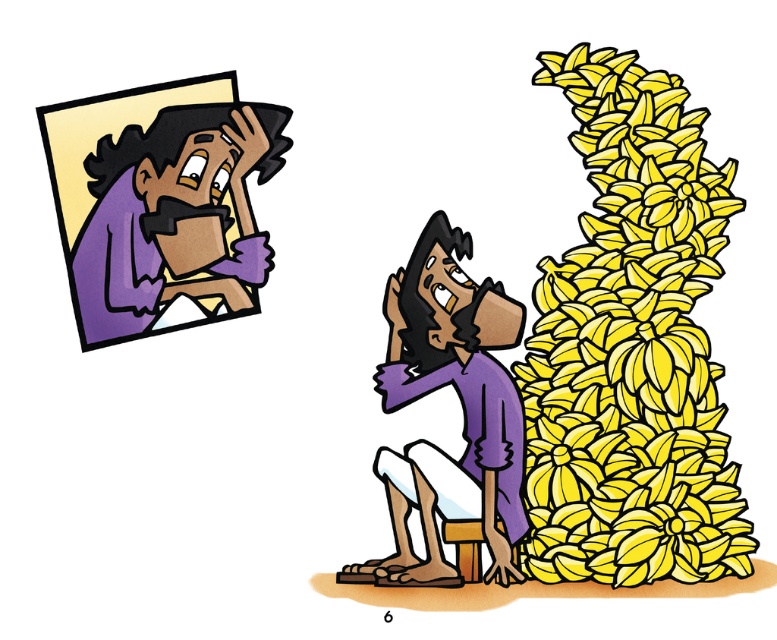
Question: Which of the following is the closest to the observer?

Choices:
 (A) purple matte/silk shirt at center
 (B) yellow matte bananas at right

Answer: (B)

Question: Where is purple matte headscarf at upper left located in relation to purple matte/silk shirt at center in the image?

Choices:
 (A) below
 (B) above

Answer: (B)

Question: Among these objects, which one is farthest from the camera?

Choices:
 (A) yellow matte bananas at right
 (B) purple matte/silk shirt at center
 (C) purple matte headscarf at upper left

Answer: (C)

Question: Does yellow matte bananas at right have a lesser width compared to purple matte/silk shirt at center?

Choices:
 (A) yes
 (B) no

Answer: (B)

Question: Can you confirm if yellow matte bananas at right is positioned above purple matte headscarf at upper left?

Choices:
 (A) no
 (B) yes

Answer: (A)

Question: Which object is positioned farthest from the purple matte/silk shirt at center?

Choices:
 (A) yellow matte bananas at right
 (B) purple matte headscarf at upper left

Answer: (B)